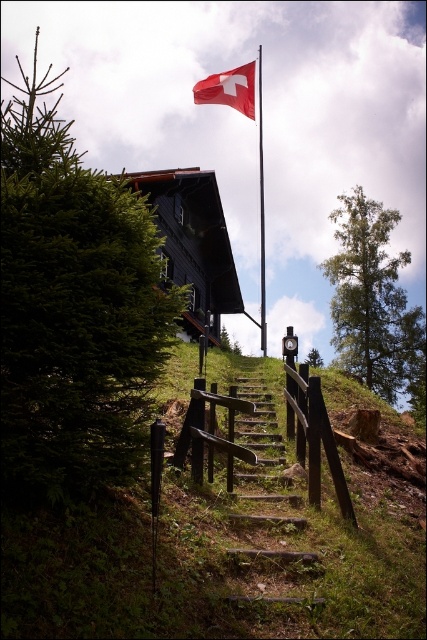
You are standing at the base of the wooden stairs at center leading to the chalet. You want to place a 2.5 meter long bench in front of the stairs so that it doesn not block the path. Is the space between you and the stairs sufficient for this?

The distance between you and the wooden stairs at center is 7.35 meters. Since the bench is only 2.5 meters long, there is enough space to place it without blocking the path.